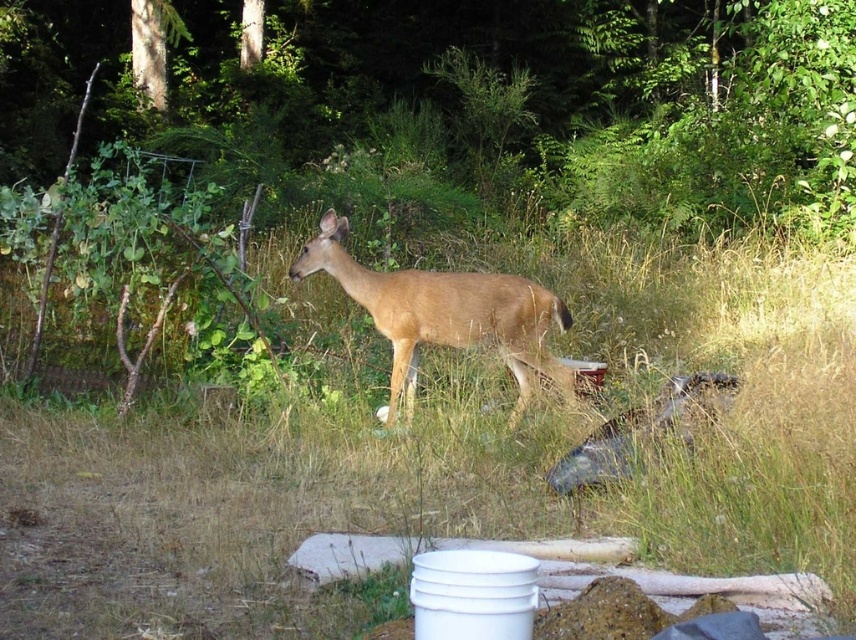
Who is taller, green grass at center or brown matte/deer at center?

With more height is brown matte/deer at center.

Can you confirm if green grass at center is bigger than brown matte/deer at center?

Actually, green grass at center might be smaller than brown matte/deer at center.

What are the coordinates of `green grass at center` in the screenshot? It's located at (x=449, y=460).